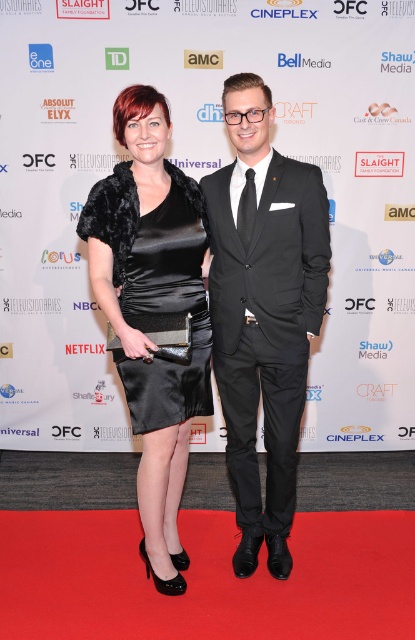
Question: Is matte black suit at center bigger than satin black dress at center?

Choices:
 (A) no
 (B) yes

Answer: (B)

Question: Does matte black suit at center have a greater width compared to satin black dress at center?

Choices:
 (A) no
 (B) yes

Answer: (B)

Question: Does matte black suit at center come behind satin black dress at center?

Choices:
 (A) no
 (B) yes

Answer: (B)